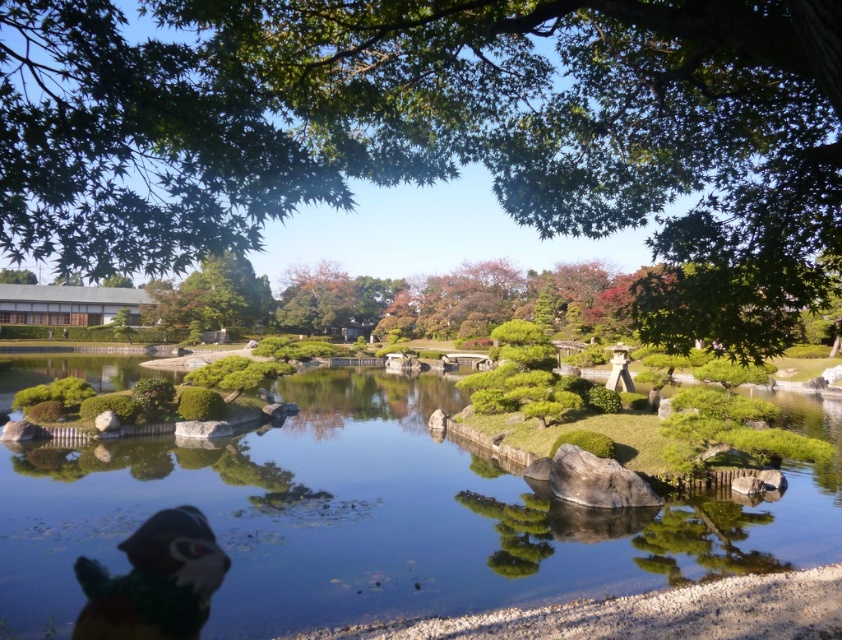
Does point (691, 538) lie in front of point (93, 600)?

No, (691, 538) is further to viewer.

Looking at this image, does clear water at pond center lie behind multicolored plush toy at lower left?

Yes, it is.

Find the location of a particular element. The image size is (842, 640). clear water at pond center is located at coordinates (372, 518).

Between green leafy tree at upper center and clear water at pond center, which one has more height?

green leafy tree at upper center is taller.

Who is higher up, green leafy tree at upper center or clear water at pond center?

green leafy tree at upper center

Where is `green leafy tree at upper center`? Image resolution: width=842 pixels, height=640 pixels. green leafy tree at upper center is located at coordinates (441, 132).

Who is positioned more to the right, green leafy tree at upper center or multicolored plush toy at lower left?

From the viewer's perspective, green leafy tree at upper center appears more on the right side.

Does point (790, 252) come behind point (201, 611)?

No.

In order to click on green leafy tree at upper center in this screenshot , I will do `click(441, 132)`.